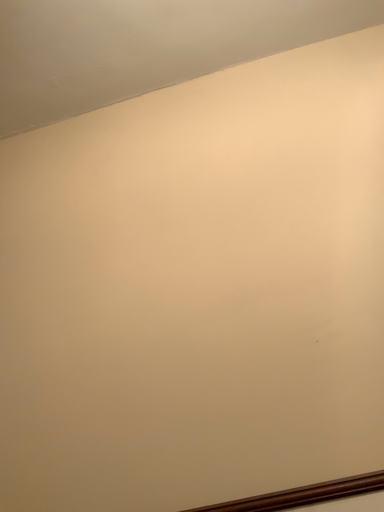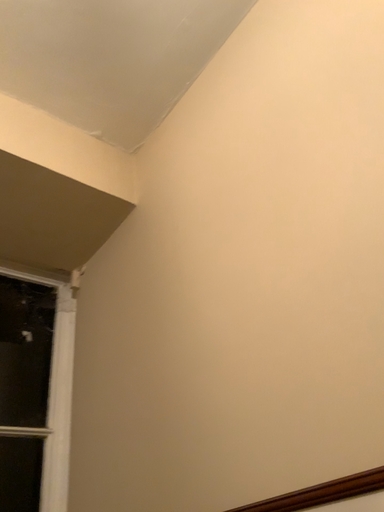
Question: Which way did the camera rotate in the video?

Choices:
 (A) rotated downward
 (B) rotated upward

Answer: (A)